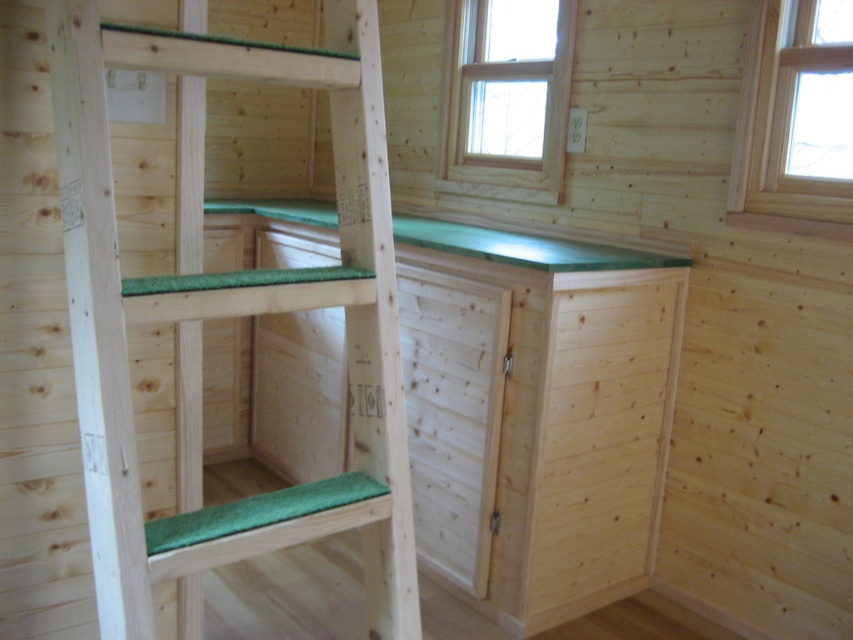
Question: Is the position of green matte wood ladder at center less distant than that of clear glass window at upper right?

Choices:
 (A) no
 (B) yes

Answer: (B)

Question: In this image, where is green matte wood ladder at center located relative to clear glass window at upper right?

Choices:
 (A) right
 (B) left

Answer: (B)

Question: Which object is closer to the camera taking this photo?

Choices:
 (A) clear glass window at upper center
 (B) green matte wood ladder at center

Answer: (B)

Question: Which object is the closest to the clear glass window at upper center?

Choices:
 (A) green matte wood ladder at center
 (B) clear glass window at upper right

Answer: (A)

Question: Can you confirm if green matte wood ladder at center is positioned to the right of clear glass window at upper right?

Choices:
 (A) yes
 (B) no

Answer: (B)

Question: Which of the following is the farthest from the observer?

Choices:
 (A) green matte wood ladder at center
 (B) clear glass window at upper center
 (C) clear glass window at upper right

Answer: (B)